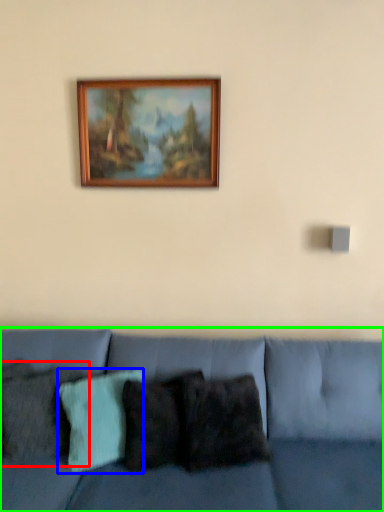
Question: Based on their relative distances, which object is farther from pillow (highlighted by a red box)? Choose from pillow (highlighted by a blue box) and studio couch (highlighted by a green box).

Choices:
 (A) pillow
 (B) studio couch

Answer: (B)